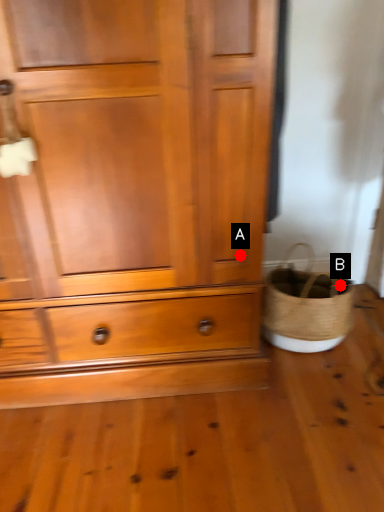
Question: Two points are circled on the image, labeled by A and B beside each circle. Which of the following is the closest to the observer?

Choices:
 (A) A is closer
 (B) B is closer

Answer: (A)